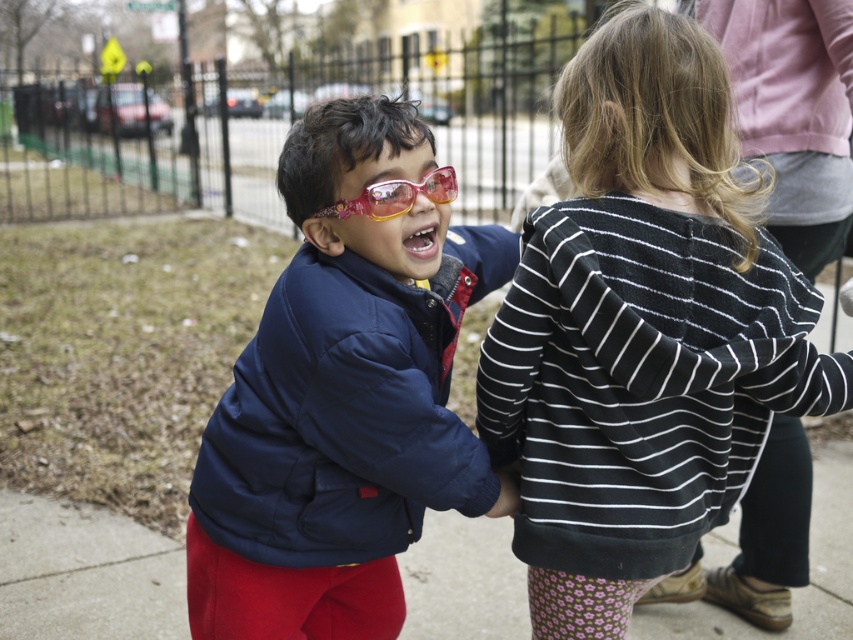
You are a photographer trying to capture a photo of both the black striped hoodie at center and the pink plastic goggles at center. The camera you have can only focus on objects within a 50 cm range. Will you be able to capture both in focus?

The distance between the black striped hoodie at center and the pink plastic goggles at center is 50.93 centimeters, which exceeds the camera focus range of 50 cm. Therefore, both objects cannot be captured in focus simultaneously.